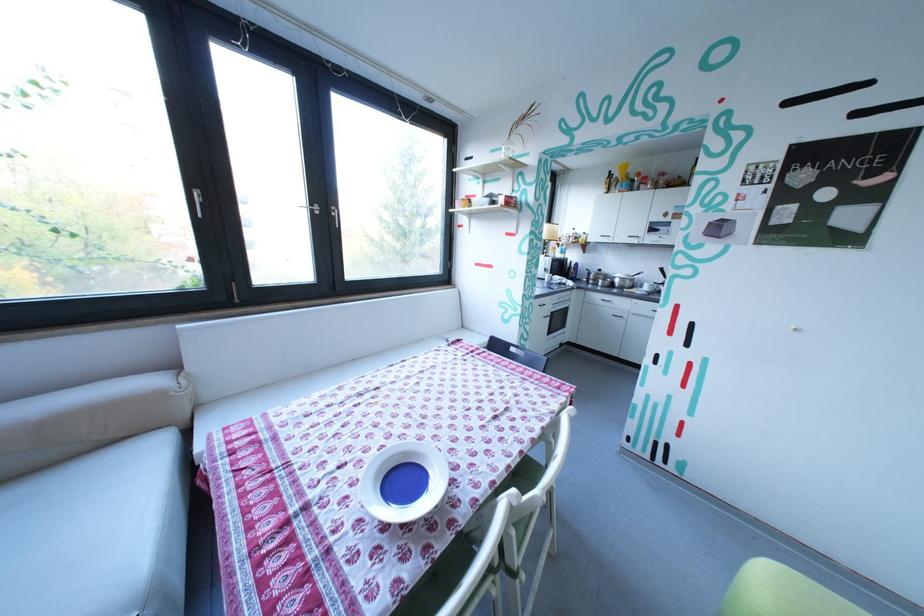
This screenshot has height=616, width=924. What do you see at coordinates (86, 549) in the screenshot?
I see `the sofa armrest` at bounding box center [86, 549].